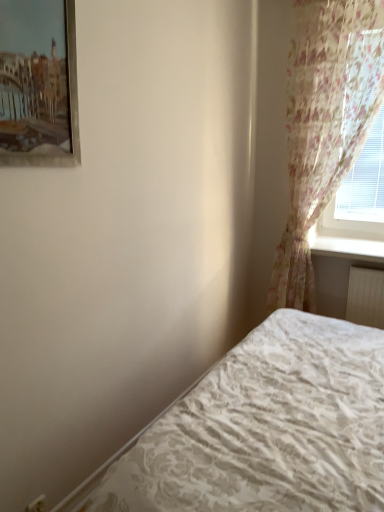
Measure the distance between white glossy window sill at upper right and camera.

The depth of white glossy window sill at upper right is 2.57 meters.

This screenshot has height=512, width=384. What do you see at coordinates (38, 84) in the screenshot?
I see `metallic silver picture frame at upper left` at bounding box center [38, 84].

What do you see at coordinates (324, 124) in the screenshot? This screenshot has height=512, width=384. I see `floral sheer curtain at right` at bounding box center [324, 124].

From the picture: What is the approximate height of floral sheer curtain at right?

floral sheer curtain at right is 2.01 meters tall.

Locate an element on the screen. This screenshot has width=384, height=512. white glossy window sill at upper right is located at coordinates (346, 247).

Does white textured bed at lower right turn towards white glossy window sill at upper right?

No, white textured bed at lower right is not turned towards white glossy window sill at upper right.

Considering the relative sizes of white textured bed at lower right and white glossy window sill at upper right in the image provided, is white textured bed at lower right shorter than white glossy window sill at upper right?

Incorrect, the height of white textured bed at lower right does not fall short of that of white glossy window sill at upper right.

You are a GUI agent. You are given a task and a screenshot of the screen. Output one action in this format:
    pyautogui.click(x=<x>, y=<y>)
    Task: Click on the window sill that is on the right side of white textured bed at lower right
    
    Given the screenshot: What is the action you would take?
    pyautogui.click(x=346, y=247)

From the image's perspective, would you say white textured bed at lower right is shown under white glossy window sill at upper right?

Indeed, from the image's perspective, white textured bed at lower right is shown beneath white glossy window sill at upper right.

Which point is more forward, [20,48] or [337,249]?

The point [20,48] is more forward.

Can you confirm if metallic silver picture frame at upper left is taller than white glossy window sill at upper right?

Yes, metallic silver picture frame at upper left is taller than white glossy window sill at upper right.

Considering the positions of objects metallic silver picture frame at upper left and white glossy window sill at upper right in the image provided, who is more to the left, metallic silver picture frame at upper left or white glossy window sill at upper right?

From the viewer's perspective, metallic silver picture frame at upper left appears more on the left side.

How different are the orientations of metallic silver picture frame at upper left and white glossy window sill at upper right in degrees?

There is a 90-degree angle between the facing directions of metallic silver picture frame at upper left and white glossy window sill at upper right.

Which is more to the right, floral sheer curtain at right or metallic silver picture frame at upper left?

floral sheer curtain at right.

Locate an element on the screen. Image resolution: width=384 pixels, height=512 pixels. curtain below the metallic silver picture frame at upper left (from the image's perspective) is located at coordinates tap(324, 124).

From a real-world perspective, is floral sheer curtain at right located beneath metallic silver picture frame at upper left?

Yes, from a real-world perspective, floral sheer curtain at right is under metallic silver picture frame at upper left.

Based on the photo, how many degrees apart are the facing directions of floral sheer curtain at right and metallic silver picture frame at upper left?

89.2 degrees separate the facing orientations of floral sheer curtain at right and metallic silver picture frame at upper left.

Is white glossy window sill at upper right smaller than floral sheer curtain at right?

Indeed, white glossy window sill at upper right has a smaller size compared to floral sheer curtain at right.

From a real-world perspective, which object stands above the other?

From a 3D spatial view, floral sheer curtain at right is above.

Is white glossy window sill at upper right far away from floral sheer curtain at right?

white glossy window sill at upper right is actually quite close to floral sheer curtain at right.

From a real-world perspective, is metallic silver picture frame at upper left located beneath floral sheer curtain at right?

Actually, metallic silver picture frame at upper left is physically above floral sheer curtain at right in the real world.

Between metallic silver picture frame at upper left and floral sheer curtain at right, which one has more height?

floral sheer curtain at right.

In the image, there is a floral sheer curtain at right. Identify the location of picture frame above it (from the image's perspective). (38, 84).

Considering the points (11, 19) and (363, 2), which point is in front, point (11, 19) or point (363, 2)?

The point (11, 19) is closer.

How different are the orientations of metallic silver picture frame at upper left and white textured bed at lower right in degrees?

They differ by 180 degrees in their facing directions.

Considering the points (47, 126) and (108, 471), which point is behind, point (47, 126) or point (108, 471)?

Point (108, 471)

I want to click on bed below the metallic silver picture frame at upper left (from a real-world perspective), so click(x=264, y=429).

From the image's perspective, is metallic silver picture frame at upper left below white textured bed at lower right?

Actually, metallic silver picture frame at upper left appears above white textured bed at lower right in the image.

Based on the photo, between white glossy window sill at upper right and metallic silver picture frame at upper left, which one has smaller width?

Thinner between the two is metallic silver picture frame at upper left.

From a real-world perspective, which object stands above the other?

metallic silver picture frame at upper left, from a real-world perspective.

Is metallic silver picture frame at upper left at the back of white glossy window sill at upper right?

No, metallic silver picture frame at upper left is not at the back of white glossy window sill at upper right.

From the image's perspective, is white glossy window sill at upper right above metallic silver picture frame at upper left?

Incorrect, from the image's perspective, white glossy window sill at upper right is lower than metallic silver picture frame at upper left.

Locate an element on the screen. window sill above the white textured bed at lower right (from a real-world perspective) is located at coordinates (346, 247).

In order to click on picture frame in front of the white glossy window sill at upper right in this screenshot , I will do `click(38, 84)`.

Looking at this image, when comparing their distances from white glossy window sill at upper right, does metallic silver picture frame at upper left or white textured bed at lower right seem closer?

white textured bed at lower right is positioned closer to the anchor white glossy window sill at upper right.

Considering their positions, is white glossy window sill at upper right positioned closer to floral sheer curtain at right than white textured bed at lower right?

The object closer to floral sheer curtain at right is white glossy window sill at upper right.

Considering their positions, is floral sheer curtain at right positioned further to white glossy window sill at upper right than white textured bed at lower right?

The object further to white glossy window sill at upper right is white textured bed at lower right.

From the image, which object appears to be nearer to white glossy window sill at upper right, metallic silver picture frame at upper left or floral sheer curtain at right?

floral sheer curtain at right is closer to white glossy window sill at upper right.

From the image, which object appears to be farther from metallic silver picture frame at upper left, white glossy window sill at upper right or floral sheer curtain at right?

Among the two, white glossy window sill at upper right is located further to metallic silver picture frame at upper left.

Considering their positions, is white textured bed at lower right positioned further to white glossy window sill at upper right than floral sheer curtain at right?

white textured bed at lower right lies further to white glossy window sill at upper right than the other object.

When comparing their distances from floral sheer curtain at right, does metallic silver picture frame at upper left or white textured bed at lower right seem closer?

white textured bed at lower right is positioned closer to the anchor floral sheer curtain at right.

Based on their spatial positions, is white glossy window sill at upper right or metallic silver picture frame at upper left closer to white textured bed at lower right?

white glossy window sill at upper right is closer to white textured bed at lower right.

The height and width of the screenshot is (512, 384). What are the coordinates of `curtain located between metallic silver picture frame at upper left and white glossy window sill at upper right in the left-right direction` in the screenshot? It's located at (324, 124).

Find the location of a particular element. This screenshot has width=384, height=512. picture frame between white textured bed at lower right and floral sheer curtain at right in the front-back direction is located at coordinates (38, 84).

Where is `curtain between white textured bed at lower right and white glossy window sill at upper right along the z-axis`? The height and width of the screenshot is (512, 384). curtain between white textured bed at lower right and white glossy window sill at upper right along the z-axis is located at coordinates (324, 124).

This screenshot has width=384, height=512. What are the coordinates of `picture frame located between white textured bed at lower right and white glossy window sill at upper right in the depth direction` in the screenshot? It's located at (38, 84).